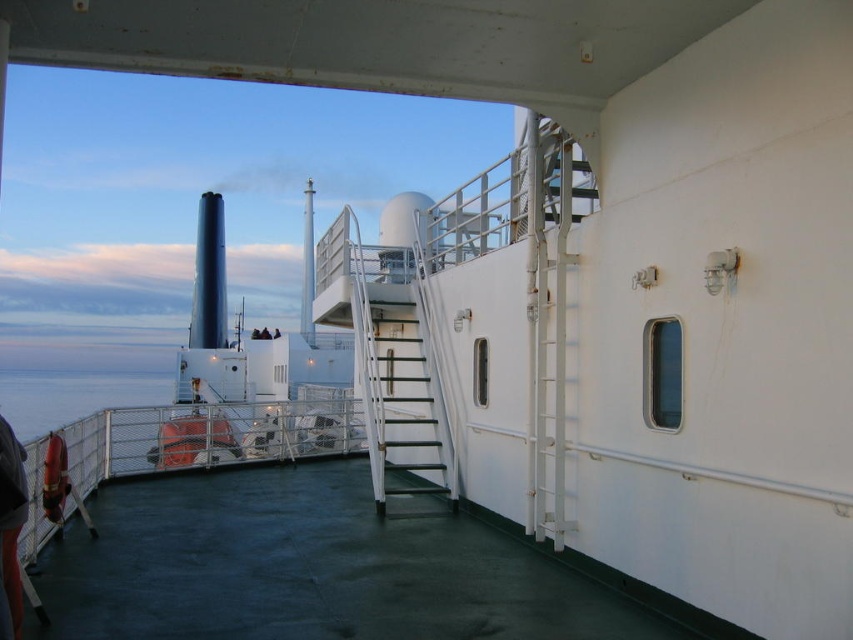
Who is positioned more to the left, white metal ladder at right or rubber lifebuoy at lower left?

Positioned to the left is rubber lifebuoy at lower left.

Consider the image. Is white metal ladder at right taller than rubber lifebuoy at lower left?

Indeed, white metal ladder at right has a greater height compared to rubber lifebuoy at lower left.

Where is `white metal ladder at right`? This screenshot has height=640, width=853. white metal ladder at right is located at coordinates (549, 314).

Does white metal staircase at center appear under white metal ladder at right?

Yes.

Find the location of a particular element. This screenshot has height=640, width=853. white metal staircase at center is located at coordinates (399, 380).

Is green rubber deck at center closer to camera compared to blue water at lower left?

Yes, green rubber deck at center is in front of blue water at lower left.

Which is behind, point (379, 564) or point (48, 387)?

Point (48, 387)

Image resolution: width=853 pixels, height=640 pixels. Find the location of `green rubber deck at center`. green rubber deck at center is located at coordinates (310, 566).